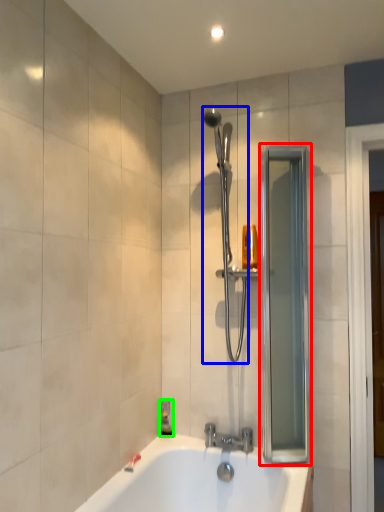
Question: Which object is the farthest from screen door (highlighted by a red box)? Choose among these: shower (highlighted by a blue box) or soap dispenser (highlighted by a green box).

Choices:
 (A) shower
 (B) soap dispenser

Answer: (B)